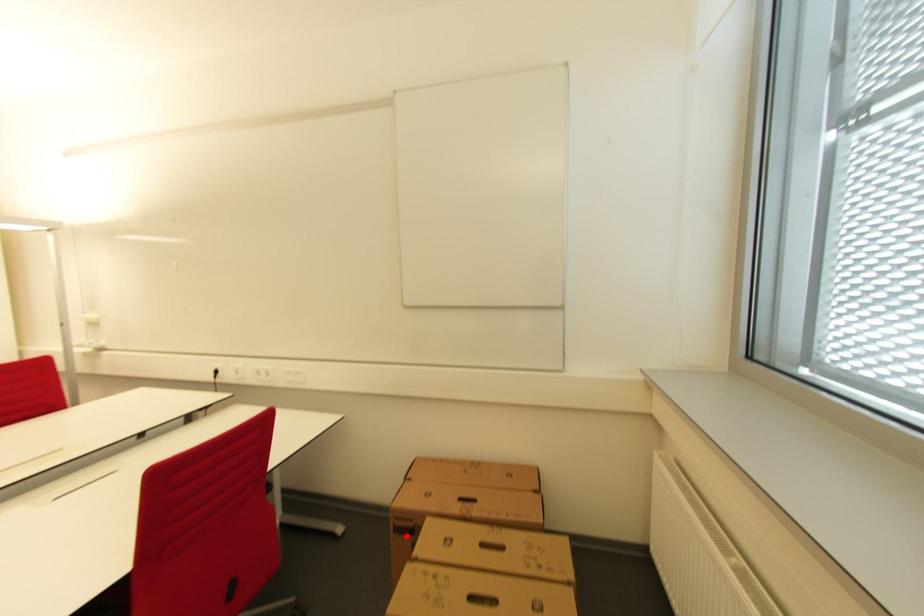
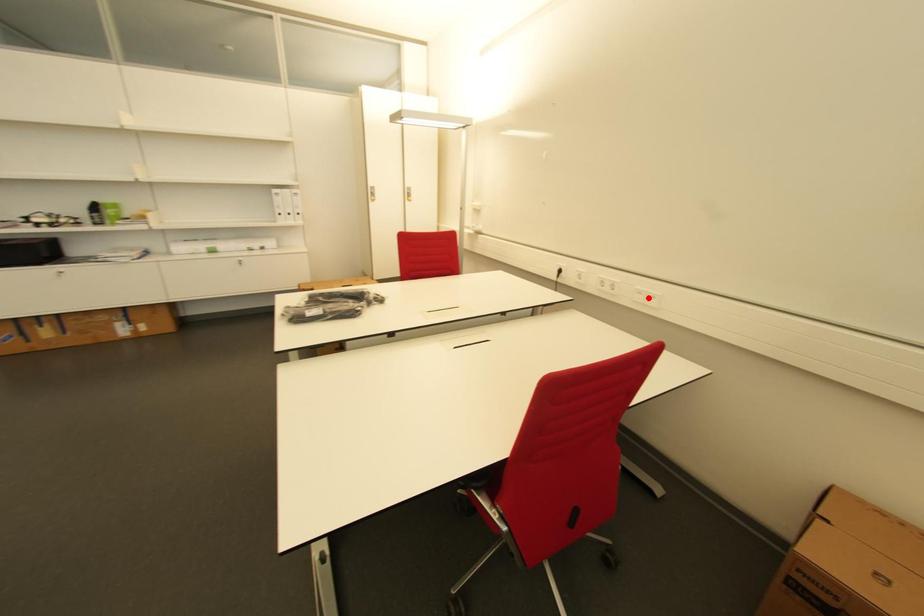
I am providing you with two images of the same scene from different viewpoints. A red point is marked on the first image and another point is marked on the second image. Are the points marked in image1 and image2 representing the same 3D position?

No